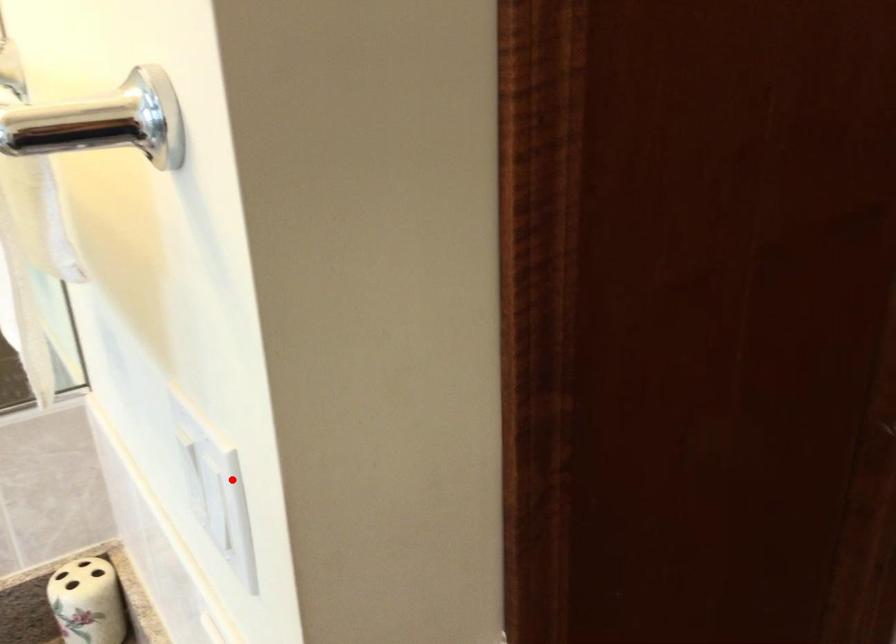
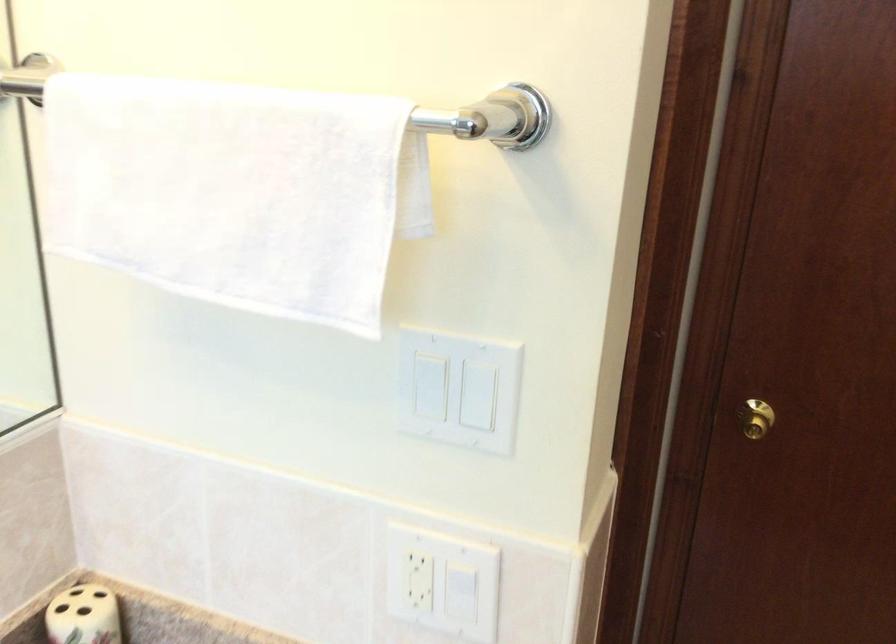
Question: A red point is marked in image1. In image2, is the corresponding 3D point closer to the camera or farther? Reply with the corresponding letter.

Choices:
 (A) The corresponding 3D point is closer.
 (B) The corresponding 3D point is farther.

Answer: (B)